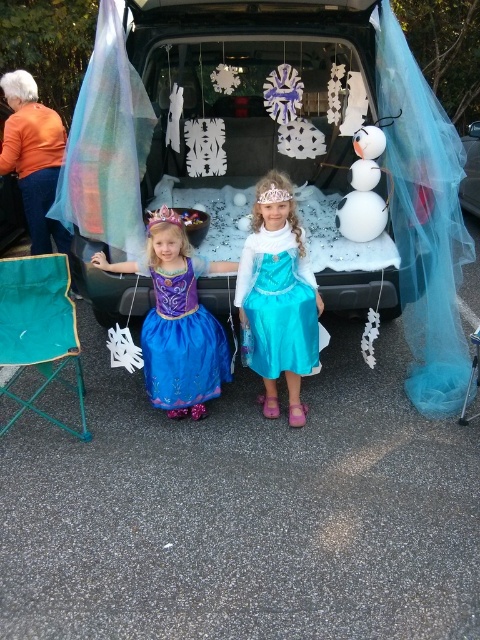
Question: Considering the relative positions of turquoise satin dress at center and blue satin dress at center in the image provided, where is turquoise satin dress at center located with respect to blue satin dress at center?

Choices:
 (A) left
 (B) right

Answer: (B)

Question: Based on their relative distances, which object is nearer to the turquoise satin dress at center?

Choices:
 (A) blue satin dress at center
 (B) white matte snowman at right

Answer: (A)

Question: Which point is farther to the camera?

Choices:
 (A) blue satin dress at center
 (B) matte purple dress at left
 (C) turquoise satin dress at center

Answer: (A)

Question: Can you confirm if matte purple dress at left is bigger than white matte snowman at right?

Choices:
 (A) no
 (B) yes

Answer: (B)

Question: Does matte purple dress at left appear on the left side of white matte snowman at right?

Choices:
 (A) yes
 (B) no

Answer: (A)

Question: Which of the following is the farthest from the observer?

Choices:
 (A) (370, 198)
 (B) (134, 241)

Answer: (A)